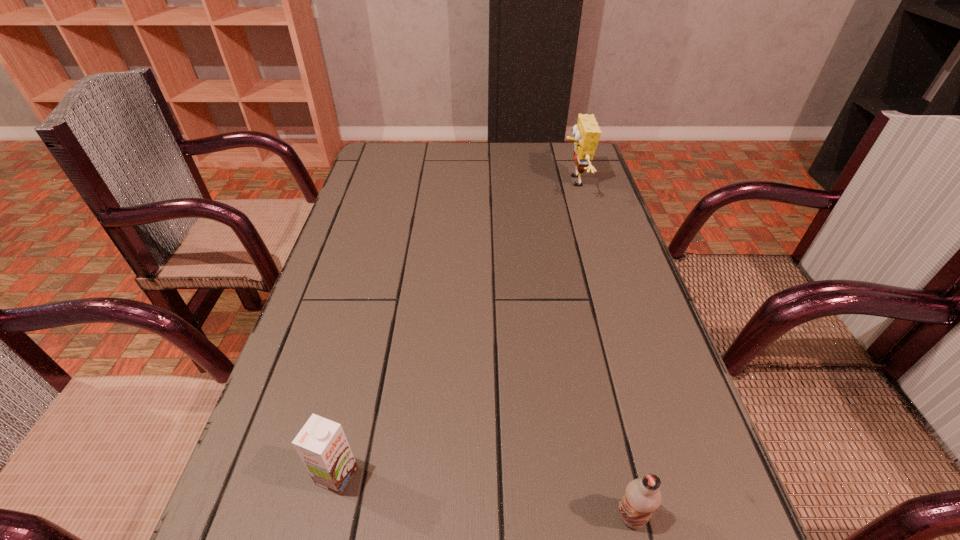
Locate an element on the screen. This screenshot has width=960, height=540. vacant area that lies between the sponge and the nearer chocolate milk is located at coordinates (603, 349).

Where is `free space between the second farthest object and the right chocolate milk`? free space between the second farthest object and the right chocolate milk is located at coordinates (484, 496).

The height and width of the screenshot is (540, 960). I want to click on vacant space that's between the nearest object and the farthest object, so [603, 349].

This screenshot has width=960, height=540. I want to click on vacant space that is in between the leftmost object and the right chocolate milk, so click(x=484, y=496).

Where is `free space that is in between the left chocolate milk and the nearest object`? The height and width of the screenshot is (540, 960). free space that is in between the left chocolate milk and the nearest object is located at coordinates [484, 496].

The image size is (960, 540). Find the location of `vacant space that's between the nearer chocolate milk and the second farthest object`. vacant space that's between the nearer chocolate milk and the second farthest object is located at coordinates (484, 496).

At what (x,y) coordinates should I click in order to perform the action: click on free spot between the nearest object and the tallest object. Please return your answer as a coordinate pair (x, y). Looking at the image, I should click on (603, 349).

Where is `empty space that is in between the nearest object and the second farthest object`? This screenshot has height=540, width=960. empty space that is in between the nearest object and the second farthest object is located at coordinates (484, 496).

The image size is (960, 540). I want to click on blank region between the right chocolate milk and the second nearest object, so pos(484,496).

Locate an element on the screen. The height and width of the screenshot is (540, 960). free space between the right chocolate milk and the left chocolate milk is located at coordinates (484, 496).